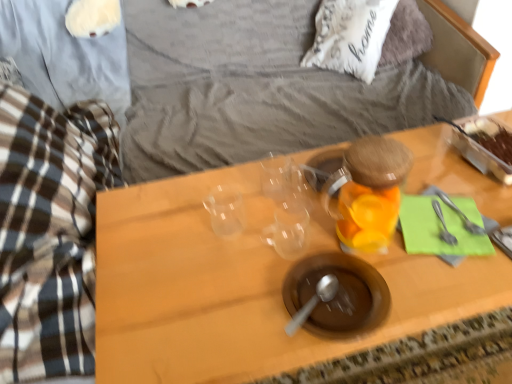
Where is `blank space situated above transparent plastic cups at center (from a real-world perspective)`? blank space situated above transparent plastic cups at center (from a real-world perspective) is located at coordinates pyautogui.click(x=333, y=217).